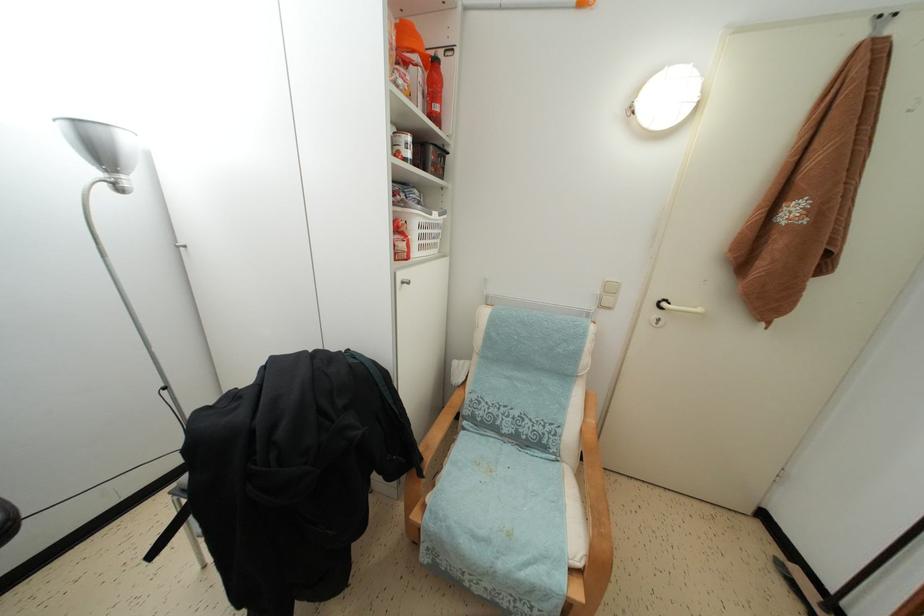
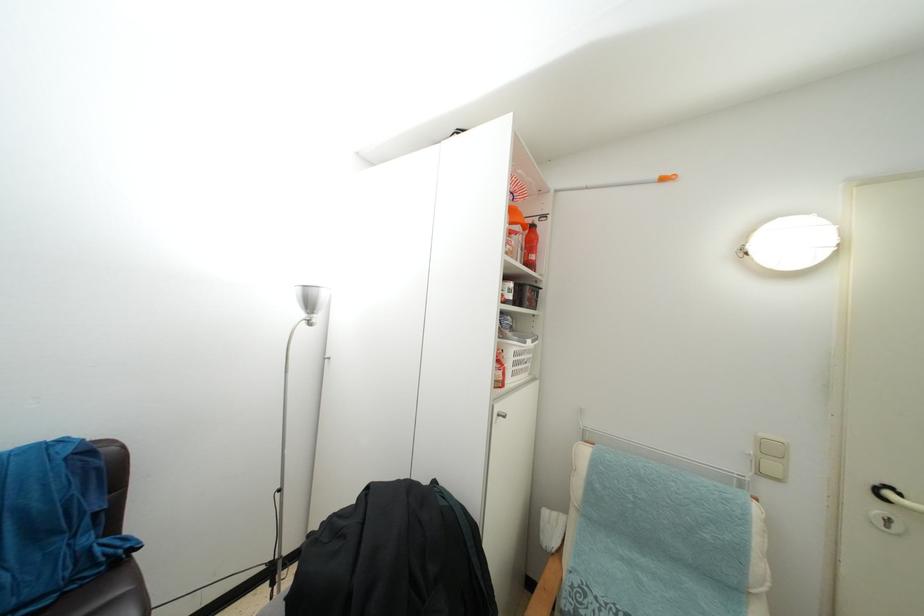
The point at [612,306] is marked in the first image. Where is the corresponding point in the second image?

(775, 472)